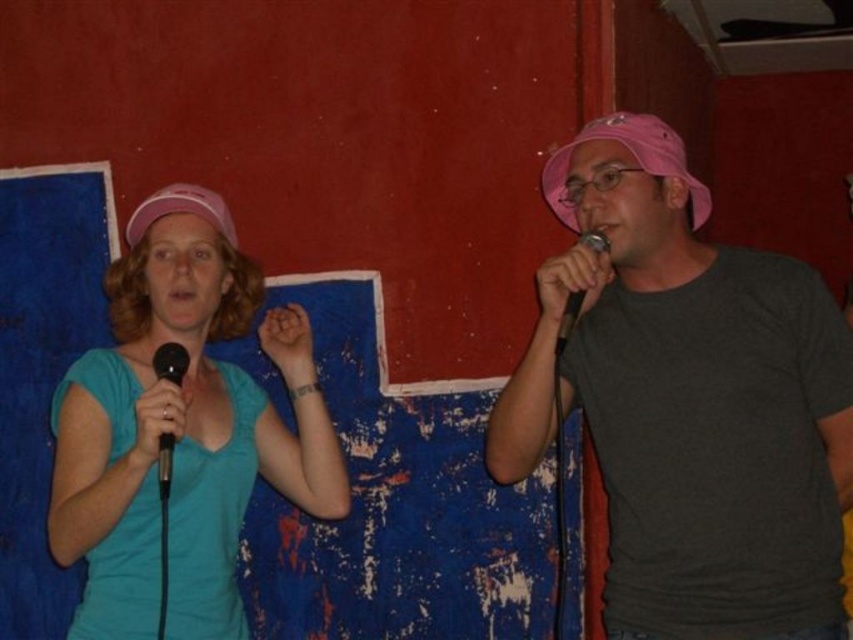
Looking at this image, between pink fabric hat at center and matte pink cap at upper center, which one is positioned lower?

pink fabric hat at center is lower down.

Is point (799, 573) behind point (599, 232)?

No.

In order to click on pink fabric hat at center in this screenshot , I will do `click(689, 401)`.

In the scene shown: Does black matte microphone at left appear over pink matte cap at upper left?

No, black matte microphone at left is not above pink matte cap at upper left.

In the scene shown: Does black matte microphone at left come in front of pink matte cap at upper left?

Yes, it is in front of pink matte cap at upper left.

Does point (155, 355) come behind point (184, 301)?

No, it is not.

Identify the location of black matte microphone at left. (170, 362).

Find the location of a particular element. pink fabric hat at center is located at coordinates (689, 401).

Consider the image. Can you confirm if pink fabric hat at center is smaller than black matte microphone at left?

Incorrect, pink fabric hat at center is not smaller in size than black matte microphone at left.

Where is `pink fabric hat at center`? The height and width of the screenshot is (640, 853). pink fabric hat at center is located at coordinates (689, 401).